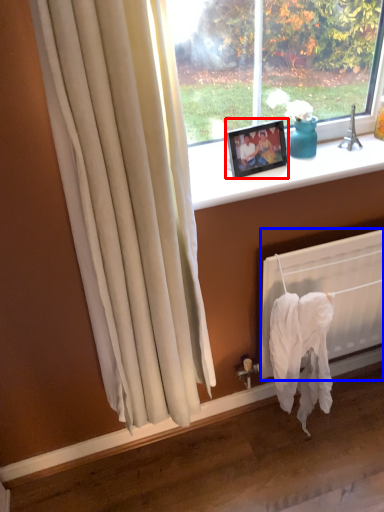
Question: Among these objects, which one is farthest to the camera, picture frame (highlighted by a red box) or radiator (highlighted by a blue box)?

Choices:
 (A) picture frame
 (B) radiator

Answer: (B)